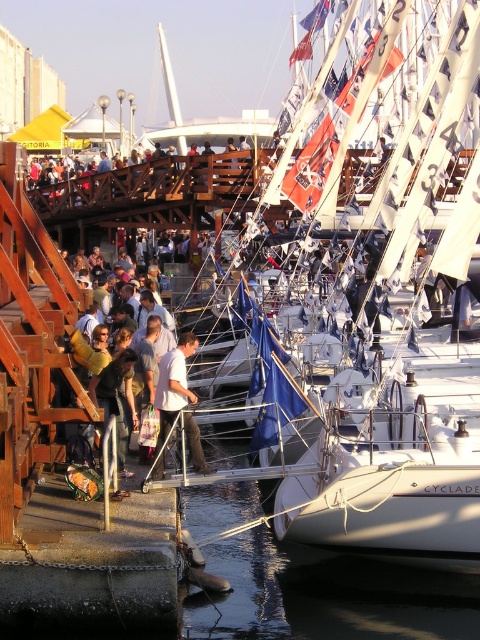
You are a photographer standing on the wooden walkway at the marina. You want to take a photo of the white cotton shirt at center and dark blue jeans at center. The minimum distance required for your camera to focus on both subjects clearly is 3 meters. Will you be able to capture both in focus?

The white cotton shirt at center and dark blue jeans at center are 2.94 meters apart from each other. Since the required distance is 3 meters, the camera cannot focus on both subjects clearly as the distance is slightly less than needed.

You are a tour guide leading a group along the wooden walkway at the marina. You notice a tourist wearing a light brown leather jacket at center and another tourist wearing dark blue jeans at center. If you want to ensure that all tourists stay within 5 meters of you for safety, are both tourists within the safe distance?

The light brown leather jacket at center and dark blue jeans at center are 8.33 meters apart from each other. Since the safe distance is 5 meters, both tourists are outside the safe radius and need to be reminded to stay closer.

You are standing on the wooden walkway at the marina and see a person wearing a light brown leather jacket at center and dark blue jeans at center. From your perspective, which item is positioned to the left?

The light brown leather jacket at center is to the left of the dark blue jeans at center.